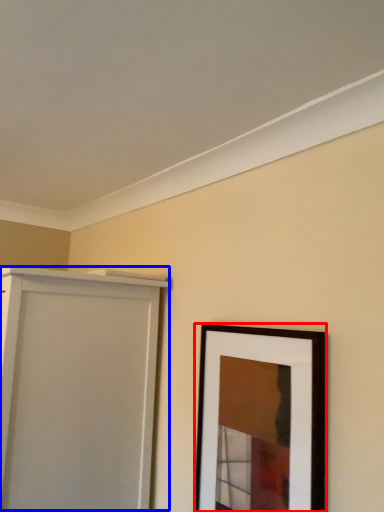
Question: Which object appears farthest to the camera in this image, picture frame (highlighted by a red box) or door (highlighted by a blue box)?

Choices:
 (A) picture frame
 (B) door

Answer: (B)